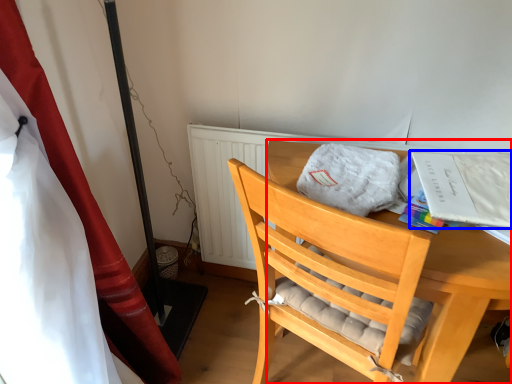
Question: Which point is closer to the camera, desk (highlighted by a red box) or magazine (highlighted by a blue box)?

Choices:
 (A) desk
 (B) magazine

Answer: (A)